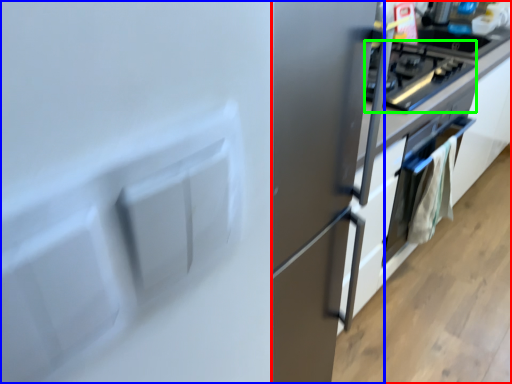
Question: Estimate the real-world distances between objects in this image. Which object is farther from cabinetry (highlighted by a red box), fridge (highlighted by a blue box) or home appliance (highlighted by a green box)?

Choices:
 (A) fridge
 (B) home appliance

Answer: (B)